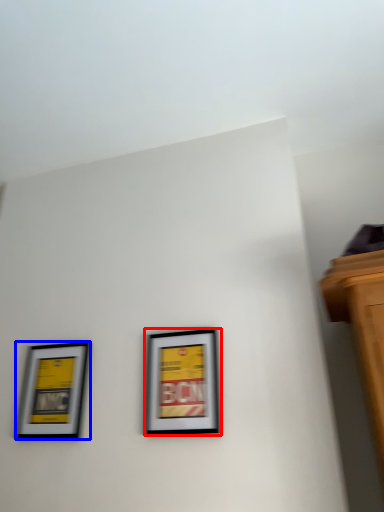
Question: Which object appears farthest to the camera in this image, picture frame (highlighted by a red box) or picture frame (highlighted by a blue box)?

Choices:
 (A) picture frame
 (B) picture frame

Answer: (B)